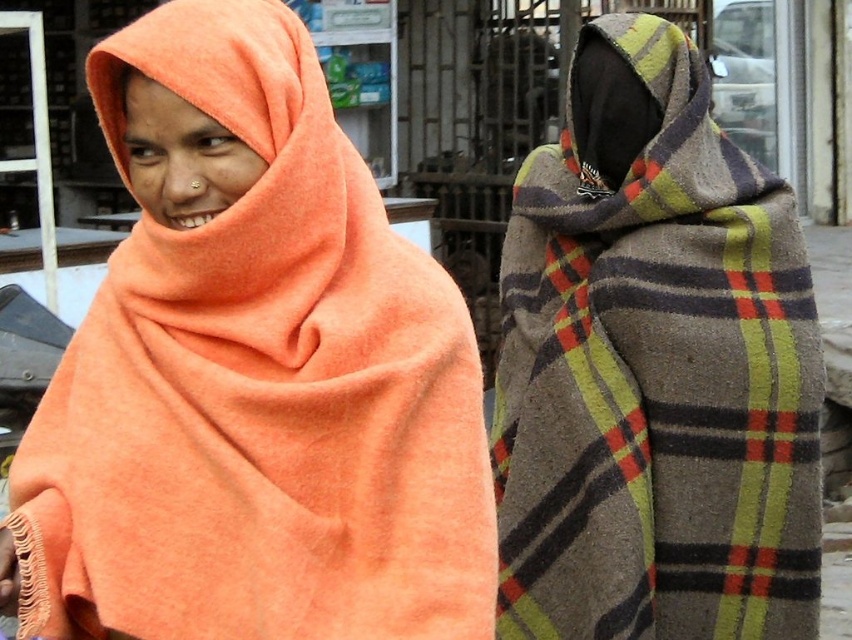
You are a photographer trying to capture the two subjects in the image. Since you want to ensure both the matte orange shawl at left and the plaid woolen scarf at right are clearly visible in your shot, which direction should you position your camera relative to the subjects?

The matte orange shawl at left is to the left of the plaid woolen scarf at right, so positioning the camera to the right side of the subjects will ensure both are clearly visible in the frame.

You are a fashion designer observing two people wearing different shawls. You need to determine which shawl is wider for a design project. Which one is wider between the matte orange shawl at left and the plaid woolen scarf at right?

The matte orange shawl at left is wider than the plaid woolen scarf at right according to the description provided.